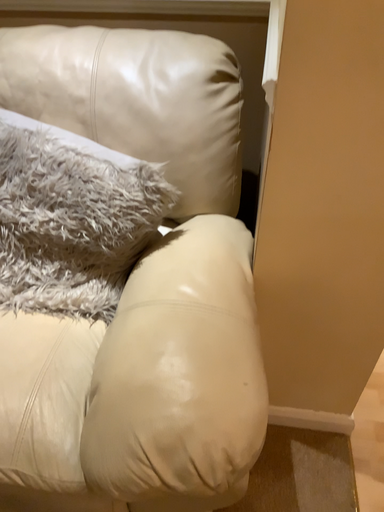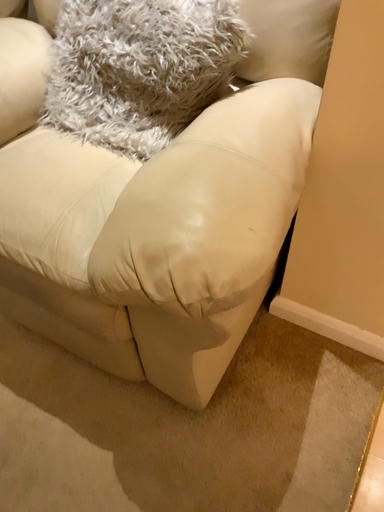
Question: How did the camera likely rotate when shooting the video?

Choices:
 (A) rotated left
 (B) rotated right

Answer: (A)